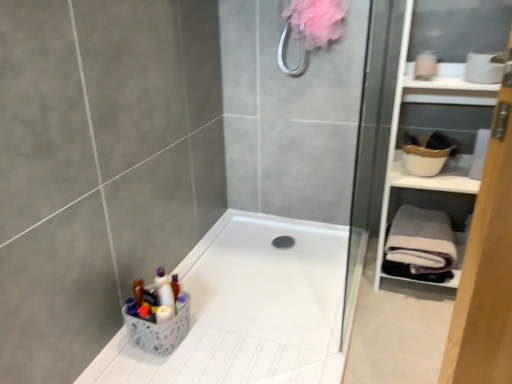
The image size is (512, 384). What do you see at coordinates (421, 241) in the screenshot? I see `gray fleece bath towel at right` at bounding box center [421, 241].

Measure the distance between point (x=179, y=315) and camera.

1.48 meters.

The width and height of the screenshot is (512, 384). What do you see at coordinates (159, 331) in the screenshot? I see `white plastic basket at lower left` at bounding box center [159, 331].

Describe the element at coordinates (442, 112) in the screenshot. I see `white matte cabinet at right` at that location.

The height and width of the screenshot is (384, 512). Find the location of `white plastic bathtub at lower left`. white plastic bathtub at lower left is located at coordinates (249, 309).

Image resolution: width=512 pixels, height=384 pixels. I want to click on gray fleece bath towel at right, so click(421, 241).

Considering the relative sizes of white plastic bathtub at lower left and gray fleece bath towel at right in the image provided, is white plastic bathtub at lower left shorter than gray fleece bath towel at right?

Yes, white plastic bathtub at lower left is shorter than gray fleece bath towel at right.

Which object is positioned more to the left, white plastic bathtub at lower left or gray fleece bath towel at right?

From the viewer's perspective, white plastic bathtub at lower left appears more on the left side.

Is white plastic bathtub at lower left behind gray fleece bath towel at right?

No.

From the image's perspective, which one is positioned lower, white plastic bathtub at lower left or gray fleece bath towel at right?

white plastic bathtub at lower left.

From the image's perspective, which is above, gray fleece bath towel at right or white plastic bathtub at lower left?

From the image's view, gray fleece bath towel at right is above.

Which is in front, point (450, 256) or point (159, 370)?

Point (159, 370)

Considering the sizes of objects gray fleece bath towel at right and white plastic bathtub at lower left in the image provided, who is smaller, gray fleece bath towel at right or white plastic bathtub at lower left?

With smaller size is gray fleece bath towel at right.

Between gray fleece bath towel at right and white plastic bathtub at lower left, which one is positioned in front?

white plastic bathtub at lower left is in front.

Does gray fleece bath towel at right have a greater width compared to white matte cabinet at right?

Yes, gray fleece bath towel at right is wider than white matte cabinet at right.

Does point (391, 224) come closer to viewer compared to point (425, 106)?

Yes, point (391, 224) is closer to viewer.

Is gray fleece bath towel at right positioned beyond the bounds of white matte cabinet at right?

No, most part of gray fleece bath towel at right lies within white matte cabinet at right.

Which is closer to the camera, (156, 344) or (451, 94)?

Point (156, 344) is positioned closer to the camera compared to point (451, 94).

From the image's perspective, is white plastic basket at lower left located beneath white matte cabinet at right?

Yes, from the image's perspective, white plastic basket at lower left is below white matte cabinet at right.

From a real-world perspective, is white plastic basket at lower left above or below white matte cabinet at right?

white plastic basket at lower left is situated lower than white matte cabinet at right in the real world.

Is the position of white plastic basket at lower left more distant than that of white matte cabinet at right?

Yes, it is behind white matte cabinet at right.

From the image's perspective, which is above, white matte cabinet at right or white plastic bathtub at lower left?

white matte cabinet at right.

Which object is thinner, white matte cabinet at right or white plastic bathtub at lower left?

white matte cabinet at right is thinner.

From a real-world perspective, is white matte cabinet at right below white plastic bathtub at lower left?

No, from a real-world perspective, white matte cabinet at right is not beneath white plastic bathtub at lower left.

Is white matte cabinet at right looking in the opposite direction of white plastic bathtub at lower left?

No, white matte cabinet at right's orientation is not away from white plastic bathtub at lower left.

How far apart are white plastic basket at lower left and gray fleece bath towel at right?

white plastic basket at lower left is 38.79 inches away from gray fleece bath towel at right.

Which object is positioned more to the left, white plastic basket at lower left or gray fleece bath towel at right?

white plastic basket at lower left is more to the left.

Can you tell me how much white plastic basket at lower left and gray fleece bath towel at right differ in facing direction?

The angle between the facing direction of white plastic basket at lower left and the facing direction of gray fleece bath towel at right is 91.1 degrees.

From the image's perspective, is white plastic basket at lower left positioned above or below gray fleece bath towel at right?

white plastic basket at lower left is situated lower than gray fleece bath towel at right in the image.

Is white plastic basket at lower left turned away from white plastic bathtub at lower left?

No, white plastic basket at lower left is not facing away from white plastic bathtub at lower left.

Is white plastic basket at lower left thinner than white plastic bathtub at lower left?

Yes, white plastic basket at lower left is thinner than white plastic bathtub at lower left.

You are a GUI agent. You are given a task and a screenshot of the screen. Output one action in this format:
    pyautogui.click(x=<x>, y=<y>)
    Task: Click on the bathtub to the right of white plastic basket at lower left
    
    Given the screenshot: What is the action you would take?
    pyautogui.click(x=249, y=309)

Is point (129, 321) less distant than point (302, 336)?

Yes.

Find the location of a particular element. This screenshot has height=384, width=512. bathtub on the left side of gray fleece bath towel at right is located at coordinates (249, 309).

You are a GUI agent. You are given a task and a screenshot of the screen. Output one action in this format:
    pyautogui.click(x=<x>, y=<y>)
    Task: Click on the bath towel lying behind the white plastic bathtub at lower left
    The height and width of the screenshot is (384, 512).
    Given the screenshot: What is the action you would take?
    pyautogui.click(x=421, y=241)

When comparing their distances from white plastic basket at lower left, does white plastic bathtub at lower left or gray fleece bath towel at right seem further?

gray fleece bath towel at right.

Based on the photo, looking at the image, which one is located further to white matte cabinet at right, white plastic basket at lower left or gray fleece bath towel at right?

The object further to white matte cabinet at right is white plastic basket at lower left.

Based on their spatial positions, is gray fleece bath towel at right or white plastic basket at lower left further from white matte cabinet at right?

white plastic basket at lower left is further to white matte cabinet at right.

Considering their positions, is white plastic bathtub at lower left positioned further to gray fleece bath towel at right than white matte cabinet at right?

Based on the image, white plastic bathtub at lower left appears to be further to gray fleece bath towel at right.

Which object lies further to the anchor point white plastic basket at lower left, white matte cabinet at right or white plastic bathtub at lower left?

white matte cabinet at right is further to white plastic basket at lower left.

Which object lies nearer to the anchor point gray fleece bath towel at right, white plastic bathtub at lower left or white plastic basket at lower left?

The object closer to gray fleece bath towel at right is white plastic bathtub at lower left.

Which object lies further to the anchor point white matte cabinet at right, white plastic bathtub at lower left or white plastic basket at lower left?

white plastic basket at lower left is positioned further to the anchor white matte cabinet at right.

From the image, which object appears to be farther from white plastic bathtub at lower left, white plastic basket at lower left or white matte cabinet at right?

white matte cabinet at right lies further to white plastic bathtub at lower left than the other object.

Find the location of `bathtub between white plastic basket at lower left and gray fleece bath towel at right in the horizontal direction`. bathtub between white plastic basket at lower left and gray fleece bath towel at right in the horizontal direction is located at coordinates (x=249, y=309).

The image size is (512, 384). Identify the location of bathtub between white plastic basket at lower left and white matte cabinet at right from left to right. (249, 309).

At what (x,y) coordinates should I click in order to perform the action: click on bath towel between white plastic bathtub at lower left and white matte cabinet at right from left to right. Please return your answer as a coordinate pair (x, y). This screenshot has width=512, height=384. Looking at the image, I should click on (421, 241).

This screenshot has width=512, height=384. I want to click on bath towel between white plastic basket at lower left and white matte cabinet at right from left to right, so click(421, 241).